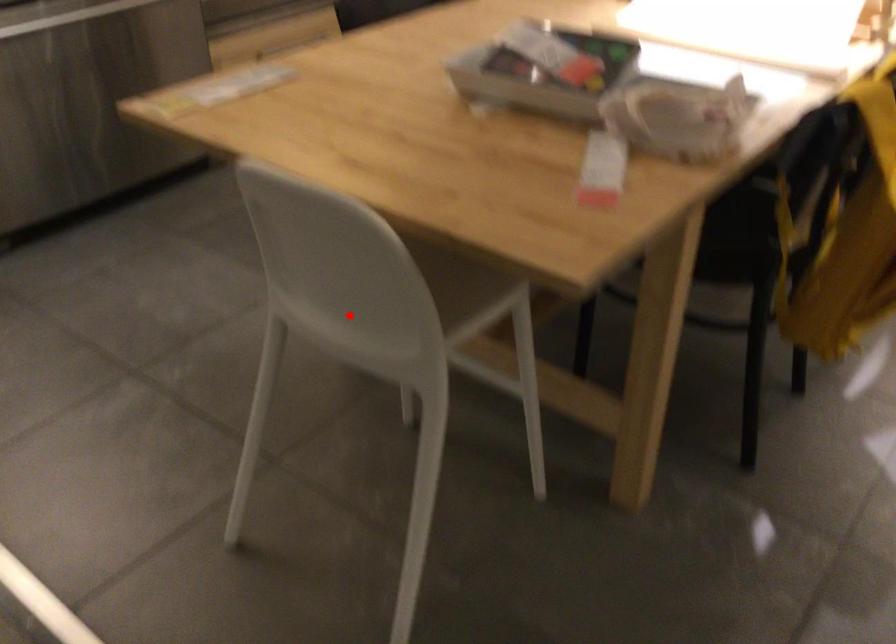
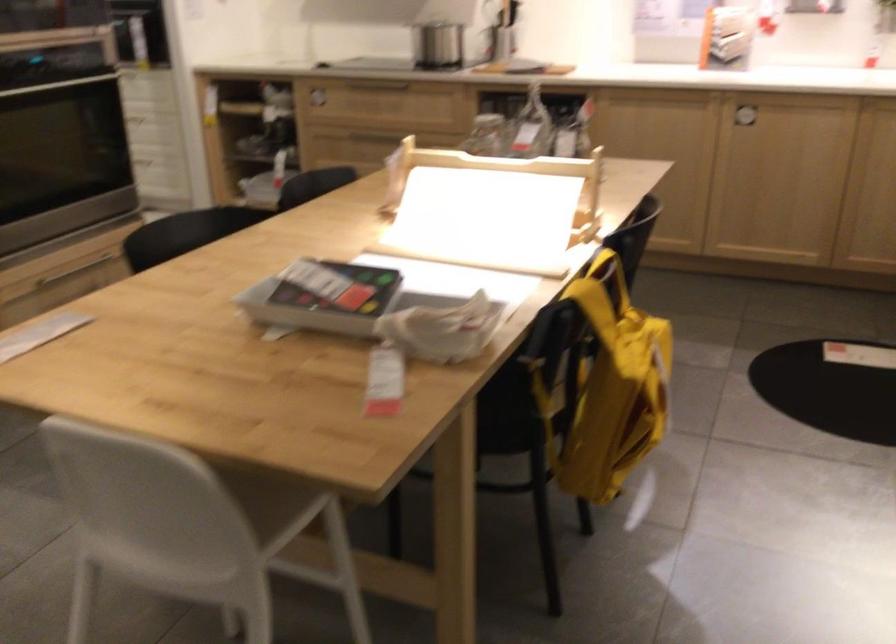
Where in the second image is the point corresponding to the highlighted location from the first image?

(171, 543)